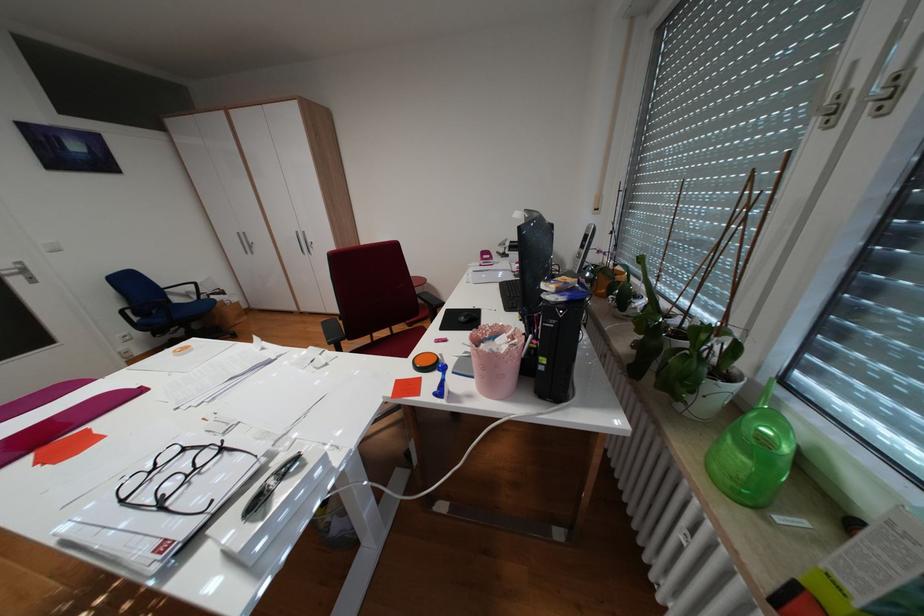
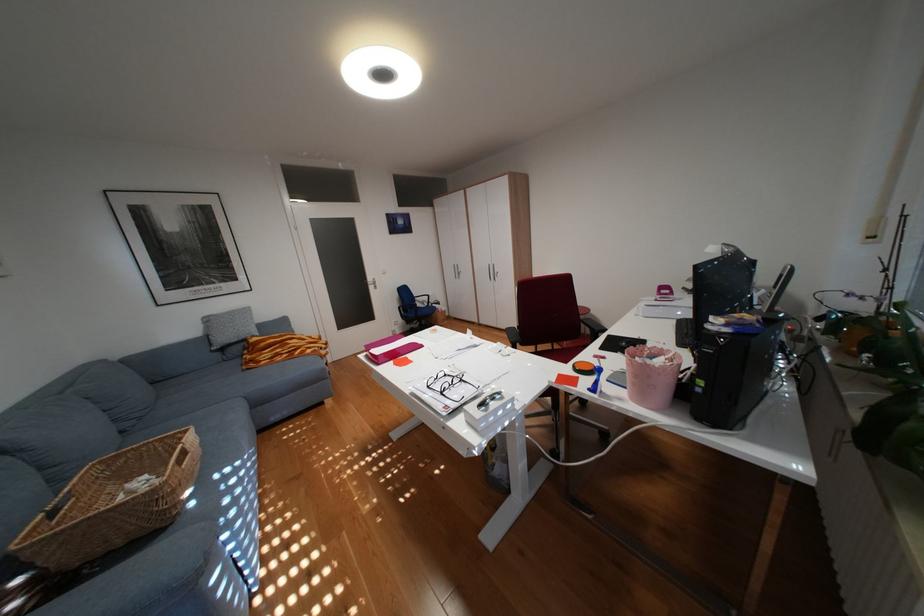
In the second image, find the point that corresponds to point (430, 374) in the first image.

(589, 374)